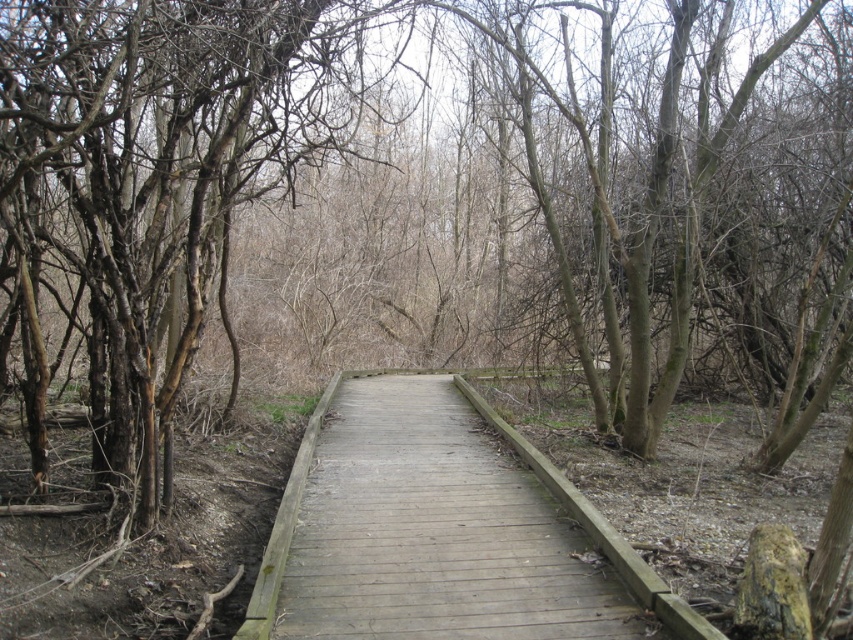
Question: Is brown bark tree at left thinner than wooden boardwalk at center?

Choices:
 (A) yes
 (B) no

Answer: (B)

Question: Can you confirm if brown bark tree at left is positioned to the left of wooden boardwalk at center?

Choices:
 (A) no
 (B) yes

Answer: (B)

Question: Does brown bark tree at left have a smaller size compared to wooden boardwalk at center?

Choices:
 (A) yes
 (B) no

Answer: (B)

Question: Which object appears closest to the camera in this image?

Choices:
 (A) brown bark tree at left
 (B) wooden boardwalk at center

Answer: (A)

Question: Which object appears closest to the camera in this image?

Choices:
 (A) wooden boardwalk at center
 (B) brown bark tree at left

Answer: (B)

Question: Which of the following is the closest to the observer?

Choices:
 (A) (502, 605)
 (B) (142, 492)

Answer: (A)